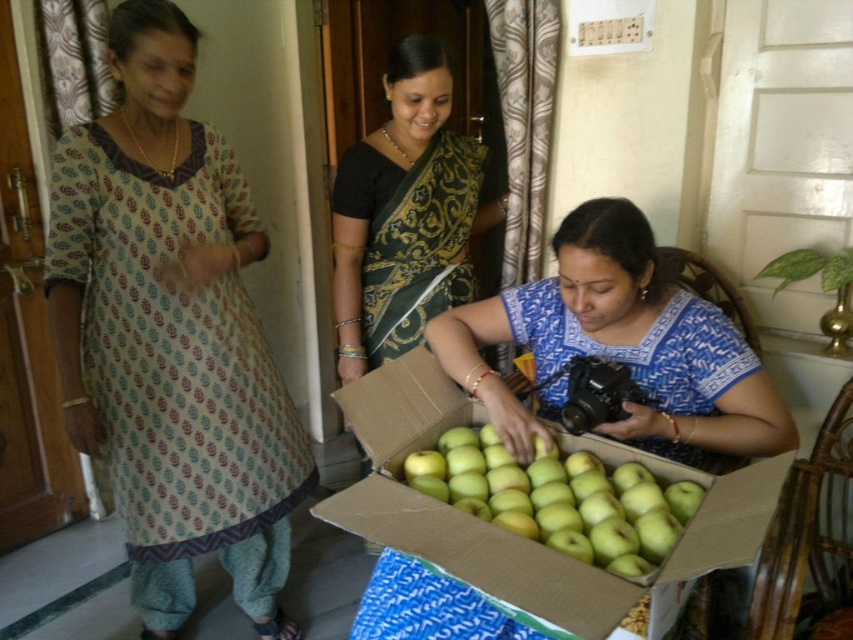
You are standing in the room and want to take a photo of the green matte cardboard box at lower center. If your camera can focus on objects within 30 inches, will you need to move closer or farther away?

The green matte cardboard box at lower center is 33.98 inches away from the camera. Since your camera can focus within 30 inches, you need to move closer to the box to get it in focus.

You are a photographer trying to capture the green matte cardboard box at lower center. However, there is a matte blue blouse at center in the way. Can you see the box through the blouse?

The matte blue blouse at center is positioned over green matte cardboard box at lower center, so the box is obscured and cannot be seen through the blouse.